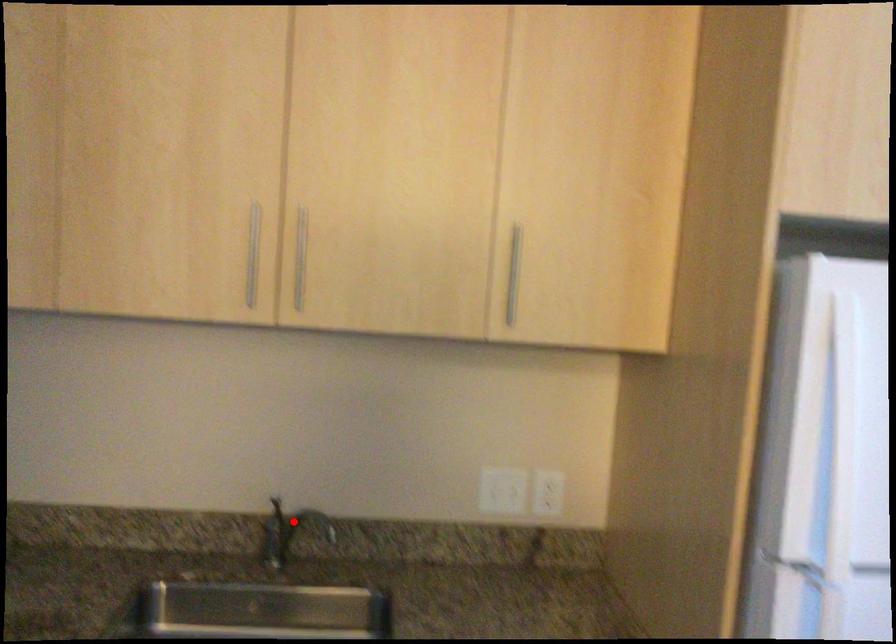
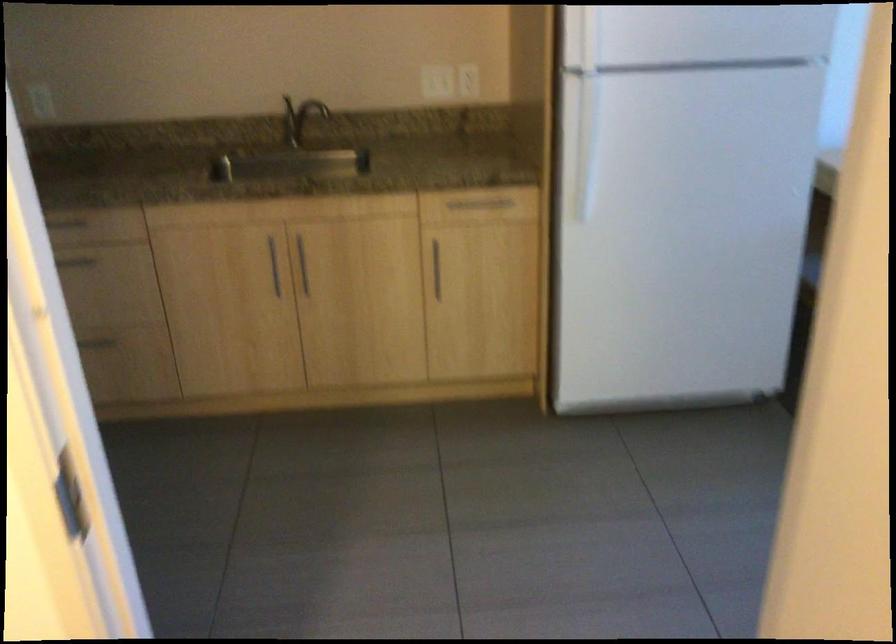
Where in the second image is the point corresponding to the highlighted location from the first image?

(299, 118)